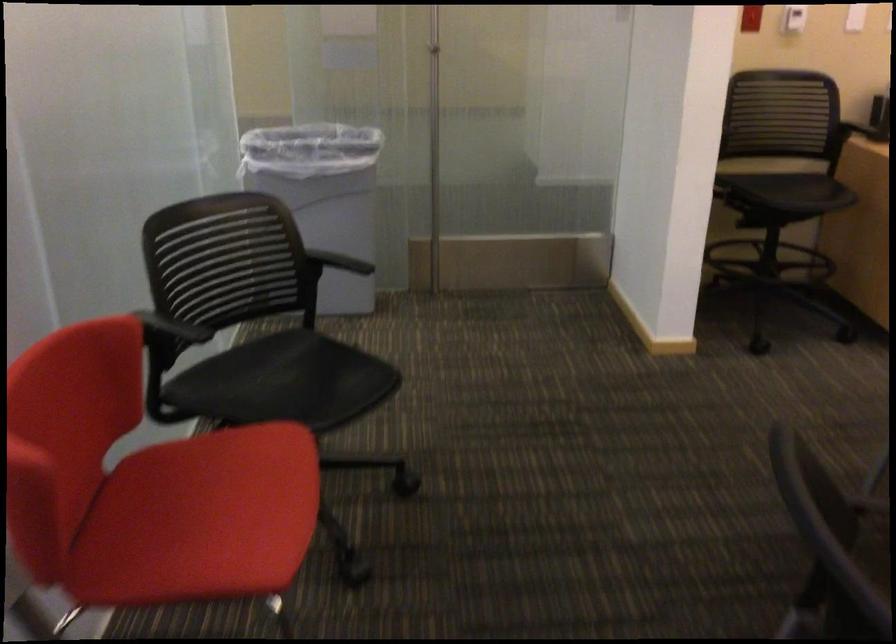
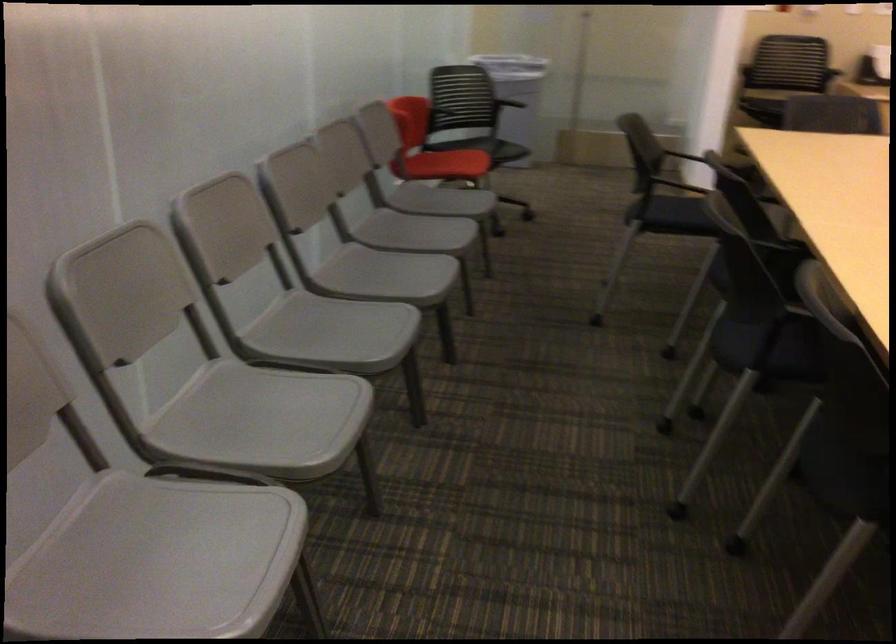
Where in the second image is the point corresponding to point (197, 560) from the first image?

(446, 164)